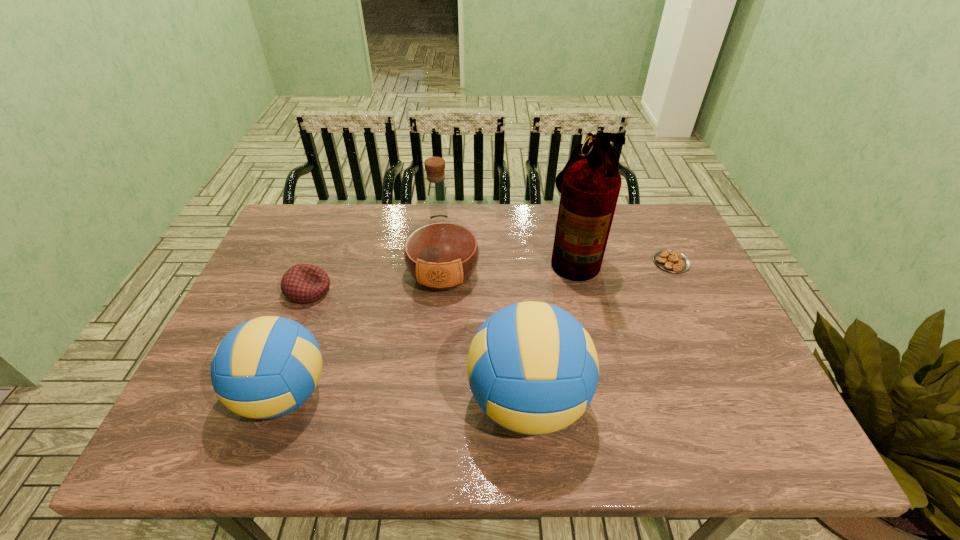
I want to click on blank space that satisfies the following two spatial constraints: 1. at the nozzle of the pastry; 2. on the right side of the tallest object, so click(x=575, y=262).

Locate an element on the screen. This screenshot has width=960, height=540. vacant space that satisfies the following two spatial constraints: 1. at the nozzle of the tallest object; 2. on the front label of the second tallest object is located at coordinates (578, 274).

Where is `vacant space that satisfies the following two spatial constraints: 1. on the front side of the taller volleyball; 2. on the right side of the beanbag`? The image size is (960, 540). vacant space that satisfies the following two spatial constraints: 1. on the front side of the taller volleyball; 2. on the right side of the beanbag is located at coordinates click(266, 401).

Locate an element on the screen. The width and height of the screenshot is (960, 540). vacant space that satisfies the following two spatial constraints: 1. at the nozzle of the shortest object; 2. on the right side of the fire extinguisher is located at coordinates (575, 262).

Locate an element on the screen. vacant region that satisfies the following two spatial constraints: 1. at the nozzle of the fire extinguisher; 2. on the front label of the fifth shortest object is located at coordinates (578, 274).